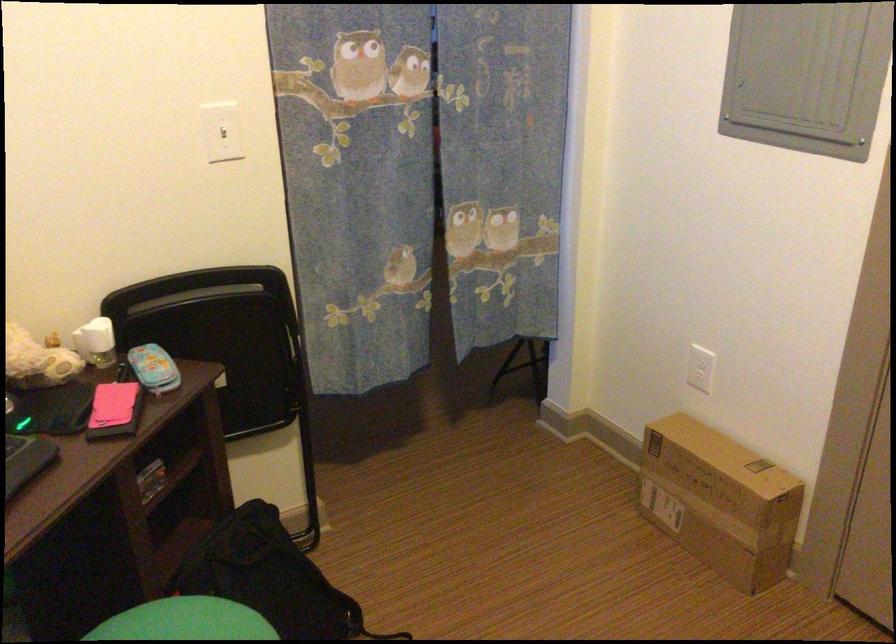
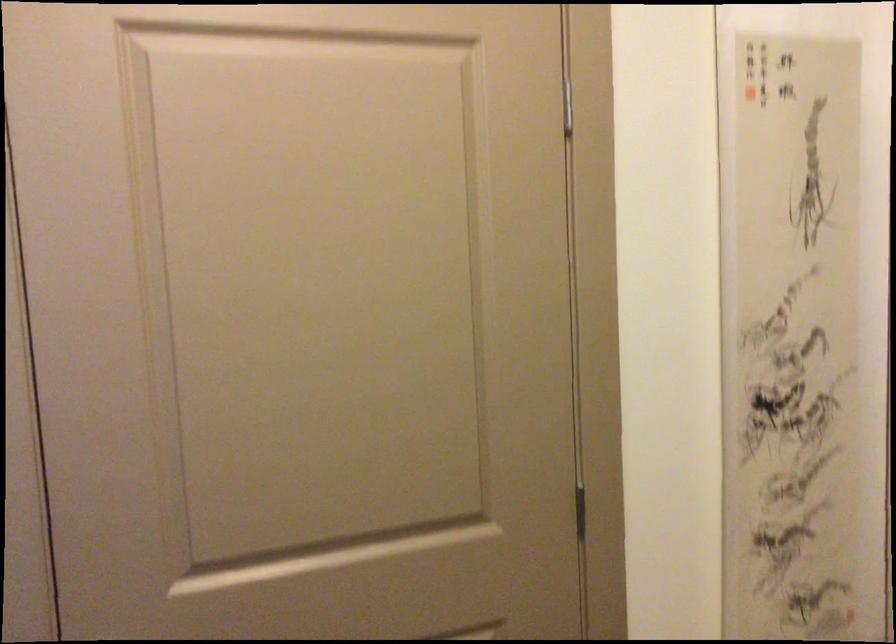
Question: The camera is either moving clockwise (left) or counter-clockwise (right) around the object. The first image is from the beginning of the video and the second image is from the end. Is the camera moving left or right when shooting the video?

Choices:
 (A) Left
 (B) Right

Answer: (A)